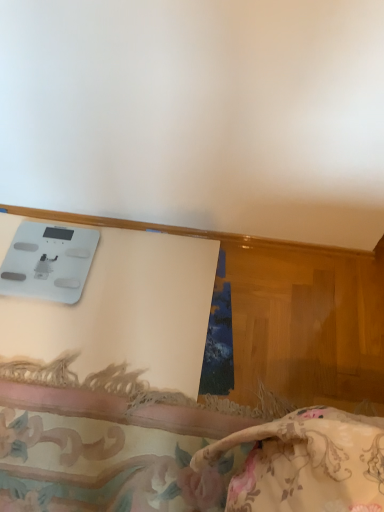
Question: Is floral fabric cushion at lower center to the left of white wood trim at upper center from the viewer's perspective?

Choices:
 (A) yes
 (B) no

Answer: (A)

Question: Is floral fabric cushion at lower center to the right of white wood trim at upper center from the viewer's perspective?

Choices:
 (A) no
 (B) yes

Answer: (A)

Question: Does floral fabric cushion at lower center have a lesser width compared to white wood trim at upper center?

Choices:
 (A) yes
 (B) no

Answer: (B)

Question: From a real-world perspective, is floral fabric cushion at lower center positioned under white wood trim at upper center based on gravity?

Choices:
 (A) no
 (B) yes

Answer: (B)

Question: From a real-world perspective, is floral fabric cushion at lower center on top of white wood trim at upper center?

Choices:
 (A) no
 (B) yes

Answer: (A)

Question: From the image's perspective, is white glossy scale at upper left above or below floral fabric cushion at lower center?

Choices:
 (A) above
 (B) below

Answer: (A)

Question: In terms of height, does white glossy scale at upper left look taller or shorter compared to floral fabric cushion at lower center?

Choices:
 (A) short
 (B) tall

Answer: (B)

Question: From a real-world perspective, is white glossy scale at upper left above or below floral fabric cushion at lower center?

Choices:
 (A) above
 (B) below

Answer: (A)

Question: Considering the relative positions of white glossy scale at upper left and floral fabric cushion at lower center in the image provided, is white glossy scale at upper left to the left or to the right of floral fabric cushion at lower center?

Choices:
 (A) right
 (B) left

Answer: (B)

Question: Does point (39, 431) appear closer or farther from the camera than point (28, 303)?

Choices:
 (A) closer
 (B) farther

Answer: (A)

Question: From the image's perspective, relative to white glossy scale at upper left, is floral fabric cushion at lower center above or below?

Choices:
 (A) below
 (B) above

Answer: (A)

Question: Is floral fabric cushion at lower center inside or outside of white glossy scale at upper left?

Choices:
 (A) outside
 (B) inside

Answer: (A)

Question: From a real-world perspective, is floral fabric cushion at lower center above or below white glossy scale at upper left?

Choices:
 (A) below
 (B) above

Answer: (A)

Question: Do you think white glossy scale at upper left is within white wood trim at upper center, or outside of it?

Choices:
 (A) inside
 (B) outside

Answer: (B)

Question: From a real-world perspective, relative to white wood trim at upper center, is white glossy scale at upper left vertically above or below?

Choices:
 (A) above
 (B) below

Answer: (B)